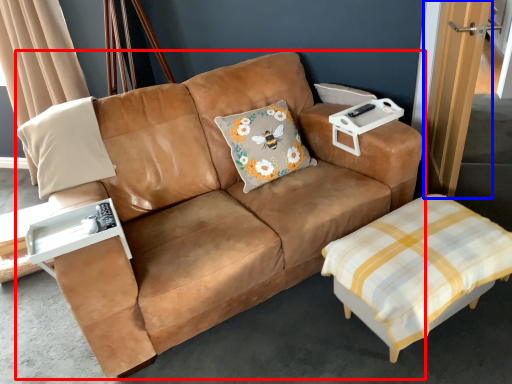
Question: Which object is closer to the camera taking this photo, studio couch (highlighted by a red box) or door (highlighted by a blue box)?

Choices:
 (A) studio couch
 (B) door

Answer: (A)